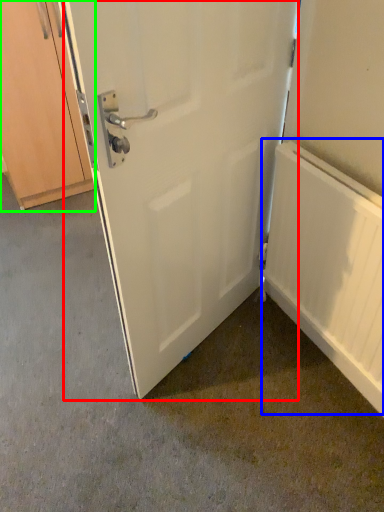
Question: Considering the real-world distances, which object is closest to door (highlighted by a red box)? radiator (highlighted by a blue box) or cabinetry (highlighted by a green box).

Choices:
 (A) radiator
 (B) cabinetry

Answer: (A)